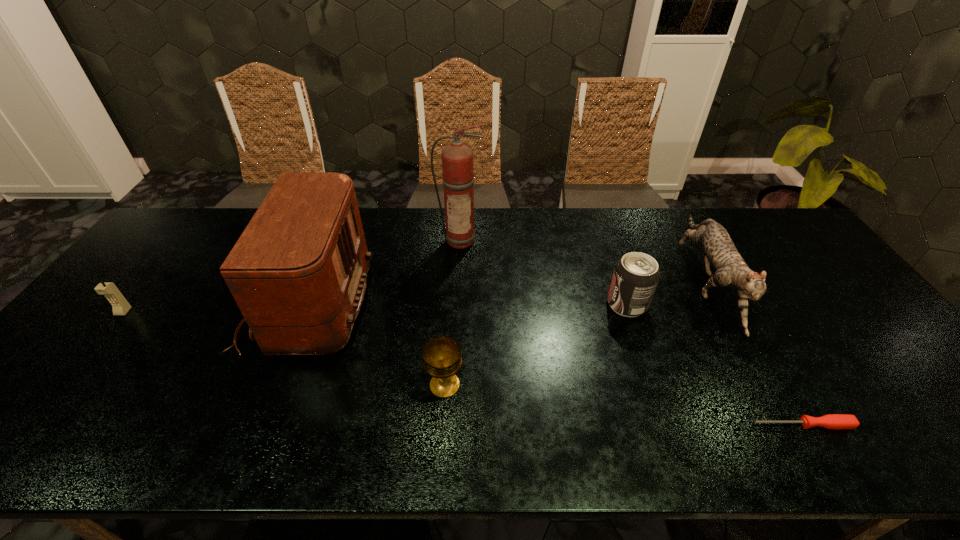
Locate an element on the screen. cat present at the far edge is located at coordinates (731, 270).

Locate an element on the screen. object positioned at the near edge is located at coordinates (831, 421).

Identify the location of object that is positioned at the left edge. The image size is (960, 540). (120, 306).

The image size is (960, 540). I want to click on free space at the far edge of the desktop, so click(x=494, y=246).

Find the location of `free space at the near edge of the desktop`. free space at the near edge of the desktop is located at coordinates tap(221, 433).

In order to click on free space at the left edge of the desktop in this screenshot , I will do (x=113, y=325).

At what (x,y) coordinates should I click in order to perform the action: click on free space between the soda can and the sixth object from right to left. Please return your answer as a coordinate pair (x, y). This screenshot has width=960, height=540. Looking at the image, I should click on (468, 304).

I want to click on free space between the tallest object and the radio receiver, so click(384, 272).

Identify the location of blank region between the sixth shortest object and the nearest object. (555, 364).

Locate an element on the screen. This screenshot has width=960, height=540. free point between the shortest object and the soda can is located at coordinates (714, 364).